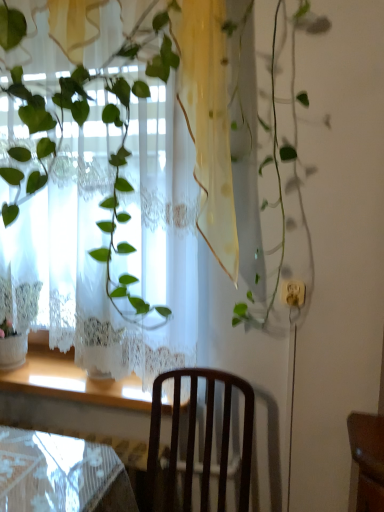
What do you see at coordinates (72, 381) in the screenshot?
I see `wooden at lower left` at bounding box center [72, 381].

Image resolution: width=384 pixels, height=512 pixels. I want to click on dark wood chair at center, so click(x=205, y=438).

Looking at this image, is white lace curtain at upper left surrounding dark wood chair at center?

No, dark wood chair at center is not inside white lace curtain at upper left.

Which object is closer to the camera, white lace curtain at upper left or dark wood chair at center?

A: dark wood chair at center.

Which is behind, point (163, 321) or point (196, 386)?

Point (196, 386)

From the picture: Which of these two, white lace curtain at upper left or dark wood chair at center, is smaller?

Smaller between the two is dark wood chair at center.

Are dark wood chair at center and wooden at lower left located far from each other?

No, there isn't a large distance between dark wood chair at center and wooden at lower left.

From the image's perspective, is dark wood chair at center on wooden at lower left?

No.

You are a GUI agent. You are given a task and a screenshot of the screen. Output one action in this format:
    pyautogui.click(x=<x>, y=<y>)
    Task: Click on the chair on the right of wooden at lower left
    
    Given the screenshot: What is the action you would take?
    pyautogui.click(x=205, y=438)

Which object is further away from the camera taking this photo, dark wood chair at center or wooden at lower left?

wooden at lower left is more distant.

Could you tell me if wooden at lower left is facing white lace curtain at upper left?

No.

How different are the orientations of wooden at lower left and white lace curtain at upper left in degrees?

The facing directions of wooden at lower left and white lace curtain at upper left are 0.0411 degrees apart.

I want to click on window sill below the white lace curtain at upper left (from the image's perspective), so click(x=72, y=381).

From a real-world perspective, is wooden at lower left positioned over white lace curtain at upper left based on gravity?

No, from a real-world perspective, wooden at lower left is not over white lace curtain at upper left

Considering the relative sizes of white lace curtain at upper left and wooden at lower left in the image provided, is white lace curtain at upper left taller than wooden at lower left?

Yes, white lace curtain at upper left is taller than wooden at lower left.

Based on the photo, considering their positions, is white lace curtain at upper left located in front of or behind wooden at lower left?

In the image, white lace curtain at upper left appears in front of wooden at lower left.

Considering the relative sizes of white lace curtain at upper left and wooden at lower left in the image provided, is white lace curtain at upper left smaller than wooden at lower left?

No.

Is wooden at lower left facing towards dark wood chair at center?

No, wooden at lower left is not turned towards dark wood chair at center.

From a real-world perspective, who is located higher, wooden at lower left or dark wood chair at center?

wooden at lower left is physically above.

Is wooden at lower left smaller than dark wood chair at center?

Yes, wooden at lower left is smaller than dark wood chair at center.

Is wooden at lower left not near dark wood chair at center?

No, wooden at lower left is in close proximity to dark wood chair at center.

From a real-world perspective, which object rests below the other?

In real-world perspective, dark wood chair at center is lower.

Does dark wood chair at center appear on the right side of white lace curtain at upper left?

Indeed, dark wood chair at center is positioned on the right side of white lace curtain at upper left.

Is dark wood chair at center with white lace curtain at upper left?

No, dark wood chair at center is not beside white lace curtain at upper left.

You are a GUI agent. You are given a task and a screenshot of the screen. Output one action in this format:
    pyautogui.click(x=<x>, y=<y>)
    Task: Click on the chair below the white lace curtain at upper left (from the image's perspective)
    This screenshot has width=384, height=512.
    Given the screenshot: What is the action you would take?
    pyautogui.click(x=205, y=438)

This screenshot has width=384, height=512. I want to click on chair on the right of the wooden at lower left, so click(x=205, y=438).

Estimate the real-world distances between objects in this image. Which object is closer to white lace curtain at upper left, wooden at lower left or dark wood chair at center?

Among the two, dark wood chair at center is located nearer to white lace curtain at upper left.

From the image, which object appears to be nearer to wooden at lower left, dark wood chair at center or white lace curtain at upper left?

Among the two, dark wood chair at center is located nearer to wooden at lower left.

Looking at the image, which one is located closer to dark wood chair at center, wooden at lower left or white lace curtain at upper left?

wooden at lower left is closer to dark wood chair at center.

Estimate the real-world distances between objects in this image. Which object is further from dark wood chair at center, white lace curtain at upper left or wooden at lower left?

Based on the image, white lace curtain at upper left appears to be further to dark wood chair at center.

When comparing their distances from wooden at lower left, does white lace curtain at upper left or dark wood chair at center seem closer?

dark wood chair at center.

Consider the image. When comparing their distances from white lace curtain at upper left, does dark wood chair at center or wooden at lower left seem closer?

Among the two, dark wood chair at center is located nearer to white lace curtain at upper left.

The height and width of the screenshot is (512, 384). What are the coordinates of `window sill between white lace curtain at upper left and dark wood chair at center vertically` in the screenshot? It's located at (72, 381).